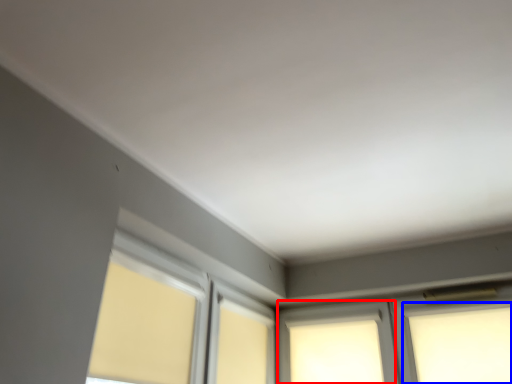
Question: Which object appears closest to the camera in this image, window (highlighted by a red box) or window (highlighted by a blue box)?

Choices:
 (A) window
 (B) window

Answer: (B)